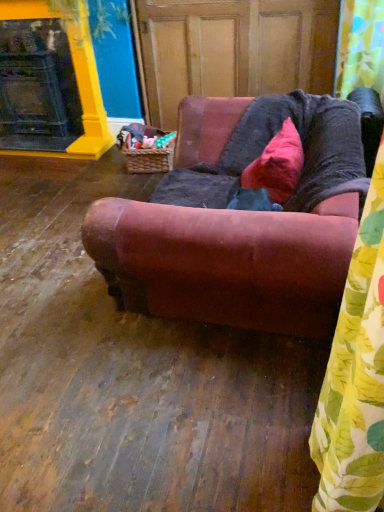
Question: Can you confirm if wooden screen door at center is smaller than yellow floral fabric shower curtain at upper right?

Choices:
 (A) no
 (B) yes

Answer: (A)

Question: Is wooden screen door at center at the right side of yellow floral fabric shower curtain at upper right?

Choices:
 (A) yes
 (B) no

Answer: (B)

Question: Is wooden screen door at center not close to yellow floral fabric shower curtain at upper right?

Choices:
 (A) no
 (B) yes

Answer: (A)

Question: Is the position of wooden screen door at center more distant than that of yellow floral fabric shower curtain at upper right?

Choices:
 (A) yes
 (B) no

Answer: (A)

Question: Is wooden screen door at center taller than yellow floral fabric shower curtain at upper right?

Choices:
 (A) no
 (B) yes

Answer: (B)

Question: Is wooden screen door at center located outside yellow floral fabric shower curtain at upper right?

Choices:
 (A) yes
 (B) no

Answer: (A)

Question: From a real-world perspective, is pink velvet pillow at upper center physically below yellow floral fabric shower curtain at upper right?

Choices:
 (A) yes
 (B) no

Answer: (A)

Question: From the image's perspective, is pink velvet pillow at upper center over yellow floral fabric shower curtain at upper right?

Choices:
 (A) yes
 (B) no

Answer: (B)

Question: Can you confirm if pink velvet pillow at upper center is thinner than yellow floral fabric shower curtain at upper right?

Choices:
 (A) no
 (B) yes

Answer: (B)

Question: Does pink velvet pillow at upper center have a greater height compared to yellow floral fabric shower curtain at upper right?

Choices:
 (A) yes
 (B) no

Answer: (B)

Question: Can you confirm if pink velvet pillow at upper center is wider than yellow floral fabric shower curtain at upper right?

Choices:
 (A) yes
 (B) no

Answer: (B)

Question: From the image's perspective, is pink velvet pillow at upper center below yellow floral fabric shower curtain at upper right?

Choices:
 (A) yes
 (B) no

Answer: (A)

Question: Does wooden screen door at center have a larger size compared to pink velvet pillow at upper center?

Choices:
 (A) yes
 (B) no

Answer: (A)